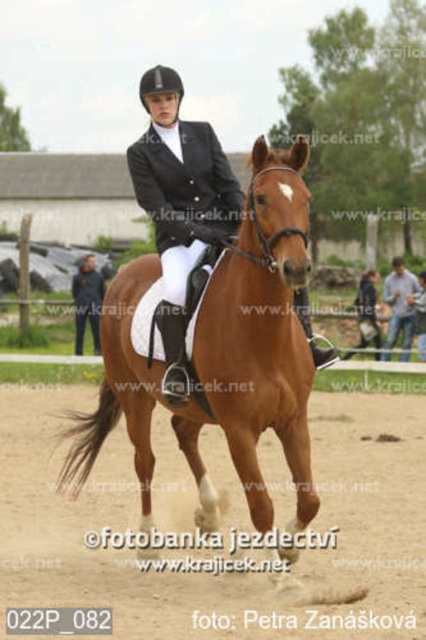
Question: Which point is closer to the camera?

Choices:
 (A) brown glossy horse at center
 (B) brown sand at center
 (C) black leather jacket at center

Answer: (A)

Question: Can you confirm if brown glossy horse at center is positioned above black leather jacket at center?

Choices:
 (A) no
 (B) yes

Answer: (A)

Question: Does brown sand at center appear under brown glossy horse at center?

Choices:
 (A) yes
 (B) no

Answer: (A)

Question: Is brown sand at center further to the viewer compared to brown glossy horse at center?

Choices:
 (A) yes
 (B) no

Answer: (A)

Question: Estimate the real-world distances between objects in this image. Which object is farther from the black leather jacket at center?

Choices:
 (A) brown glossy horse at center
 (B) brown sand at center

Answer: (B)

Question: Based on their relative distances, which object is farther from the black leather jacket at center?

Choices:
 (A) brown glossy horse at center
 (B) brown sand at center

Answer: (B)